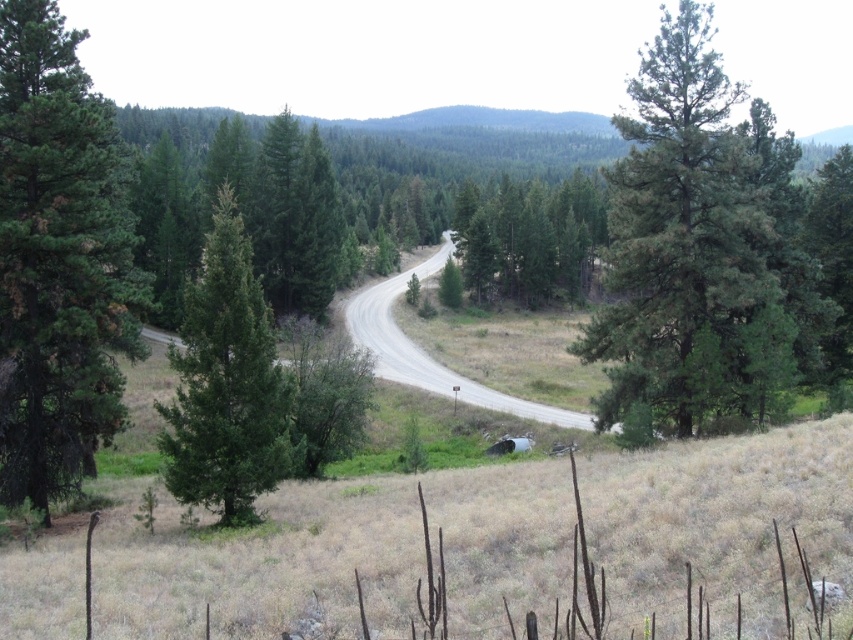
In the scene shown: You are a hiker standing at the edge of the gray asphalt road at center and want to take a photo of the green rough bark tree at left. Which object should you focus on first if you want both to be in the frame?

The green rough bark tree at left is shorter than the gray asphalt road at center, so you should focus on the gray asphalt road at center first to ensure both are in the frame.

You are standing at the starting point of the winding road in the rural landscape. You see two points marked on the road ahead of you. The first point is at coordinates point (45, 502) and the second point is at point (456, 387). Which point is closer to you as you stand at the starting point?

Point (45, 502) is closer to the viewer than point (456, 387), so the first point is closer to you.